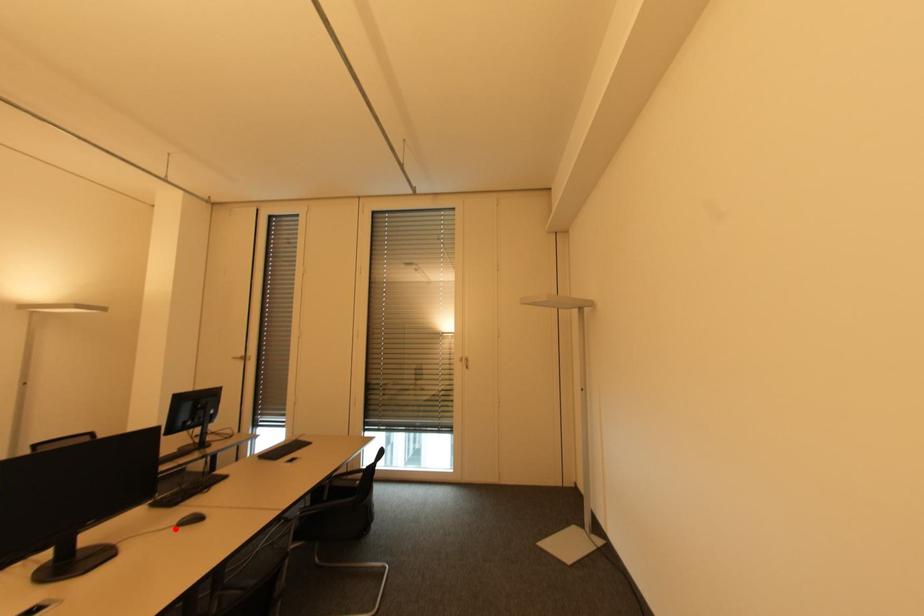
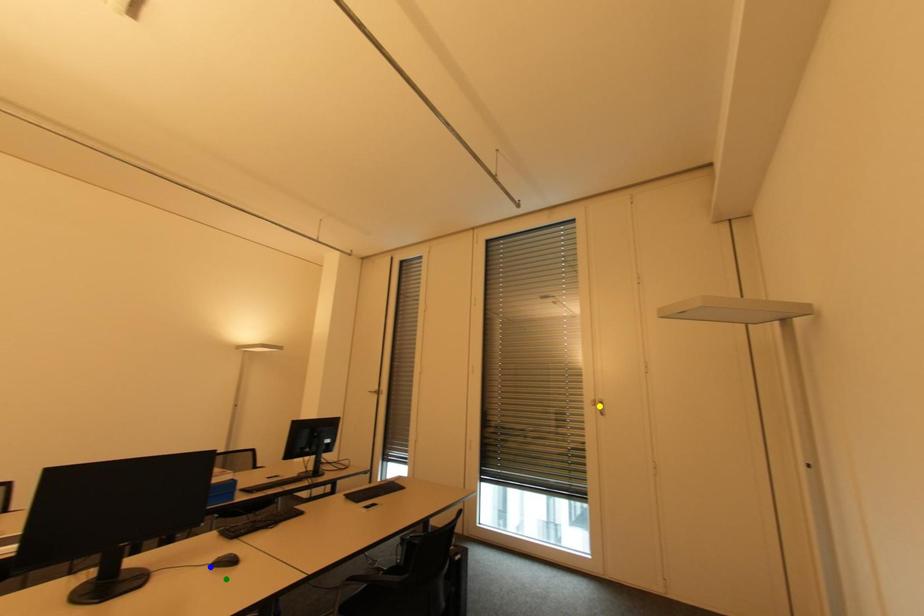
Question: I am providing you with two images of the same scene from different viewpoints. A red point is marked on the first image. You are given multiple points on the second image. Which point in image 2 represents the same 3d spot as the red point in image 1?

Choices:
 (A) yellow point
 (B) green point
 (C) blue point

Answer: (C)